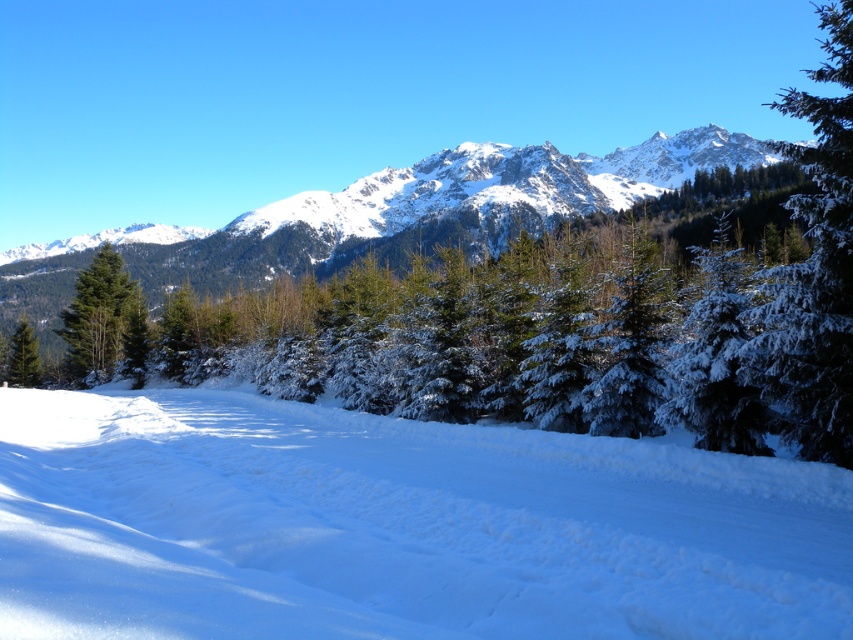
Does point (776, 272) come in front of point (79, 376)?

Yes, point (776, 272) is closer to viewer.

Describe the element at coordinates (814, 272) in the screenshot. I see `snow-covered evergreen at right` at that location.

Locate an element on the screen. This screenshot has height=640, width=853. snow-covered evergreen at right is located at coordinates (814, 272).

Is snowy rocky mountain at upper center to the right of snow-covered evergreen at right from the viewer's perspective?

No, snowy rocky mountain at upper center is not to the right of snow-covered evergreen at right.

Is snowy rocky mountain at upper center below snow-covered evergreen at right?

Indeed, snowy rocky mountain at upper center is positioned under snow-covered evergreen at right.

Does point (202, 236) come behind point (840, 282)?

Yes, it is behind point (840, 282).

You are a GUI agent. You are given a task and a screenshot of the screen. Output one action in this format:
    pyautogui.click(x=<x>, y=<y>)
    Task: Click on the snowy rocky mountain at upper center
    This screenshot has width=853, height=640.
    Given the screenshot: What is the action you would take?
    pyautogui.click(x=380, y=216)

Is white snow at lower center above green matte tree at left?

Incorrect, white snow at lower center is not positioned above green matte tree at left.

Is white snow at lower center wider than green matte tree at left?

Incorrect, white snow at lower center's width does not surpass green matte tree at left's.

Between point (119, 504) and point (73, 371), which one is positioned behind?

The point (73, 371) is more distant.

The image size is (853, 640). Find the location of `white snow at lower center`. white snow at lower center is located at coordinates (396, 528).